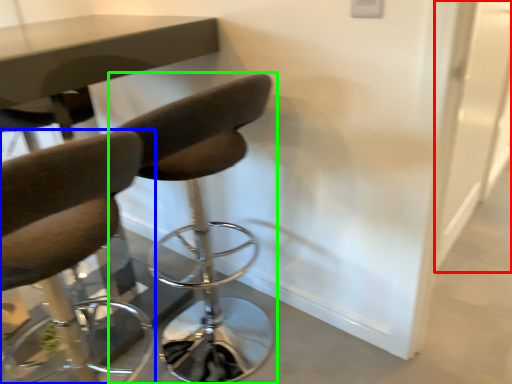
Question: Estimate the real-world distances between objects in this image. Which object is closer to glass door (highlighted by a red box), chair (highlighted by a blue box) or chair (highlighted by a green box)?

Choices:
 (A) chair
 (B) chair

Answer: (B)